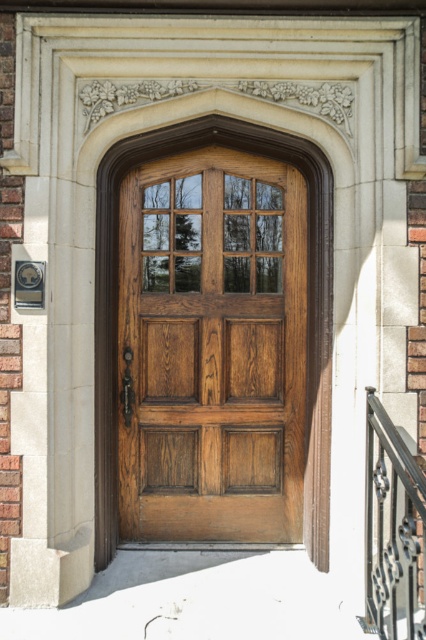
Question: Which point appears farthest from the camera in this image?

Choices:
 (A) (146, 310)
 (B) (414, 563)

Answer: (A)

Question: Does wooden door at center have a larger size compared to black wrought iron railing at lower right?

Choices:
 (A) yes
 (B) no

Answer: (A)

Question: Which of the following is the closest to the observer?

Choices:
 (A) black wrought iron railing at lower right
 (B) wooden door at center

Answer: (A)

Question: Is wooden door at center to the left of black wrought iron railing at lower right from the viewer's perspective?

Choices:
 (A) yes
 (B) no

Answer: (A)

Question: Does wooden door at center have a lesser width compared to black wrought iron railing at lower right?

Choices:
 (A) yes
 (B) no

Answer: (B)